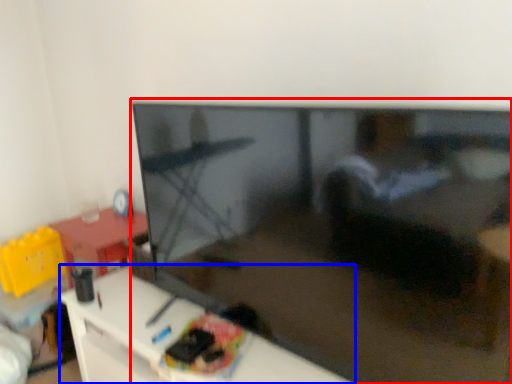
Question: Which object is closer to the camera taking this photo, television (highlighted by a red box) or furniture (highlighted by a blue box)?

Choices:
 (A) television
 (B) furniture

Answer: (A)